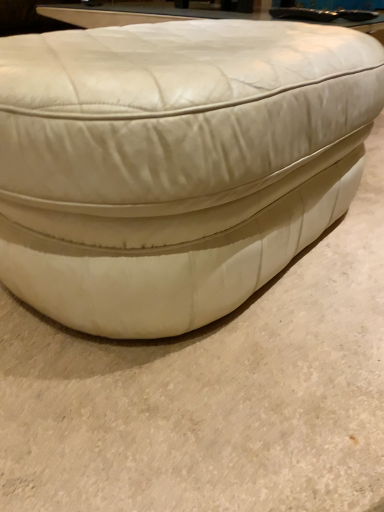
At what (x,y) coordinates should I click in order to perform the action: click on free spot above white leather ottoman at center (from a real-world perspective). Please return your answer as a coordinate pair (x, y). Looking at the image, I should click on (166, 37).